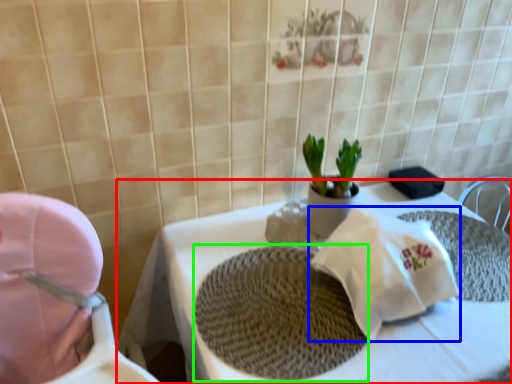
Question: Considering the real-world distances, which object is closest to table (highlighted by a red box)? material (highlighted by a blue box) or place mat (highlighted by a green box).

Choices:
 (A) material
 (B) place mat

Answer: (B)